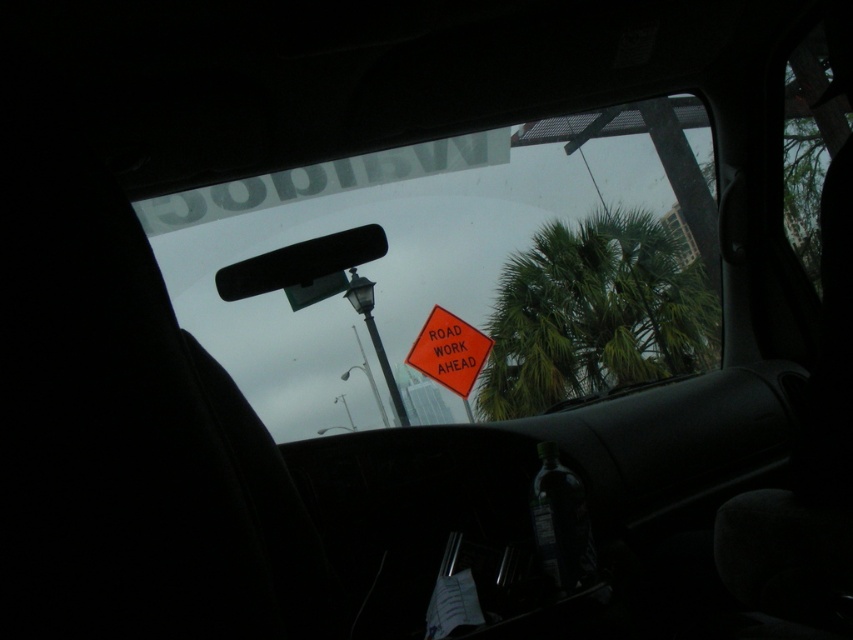
You are driving at night and see the green leafy palm tree at center and the orange reflective road sign at center through your windshield. Which object is closer to your car?

The green leafy palm tree at center is closer to your car because the orange reflective road sign at center is behind it.